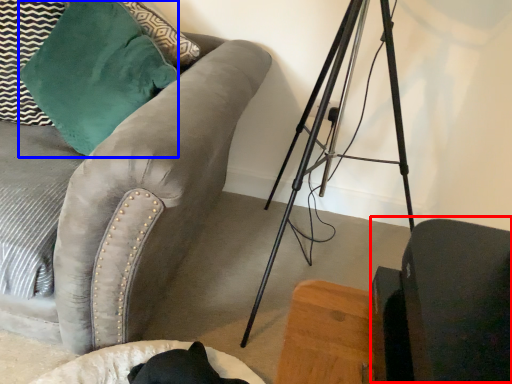
Question: Which object appears farthest to the camera in this image, swivel chair (highlighted by a red box) or throw pillow (highlighted by a blue box)?

Choices:
 (A) swivel chair
 (B) throw pillow

Answer: (B)